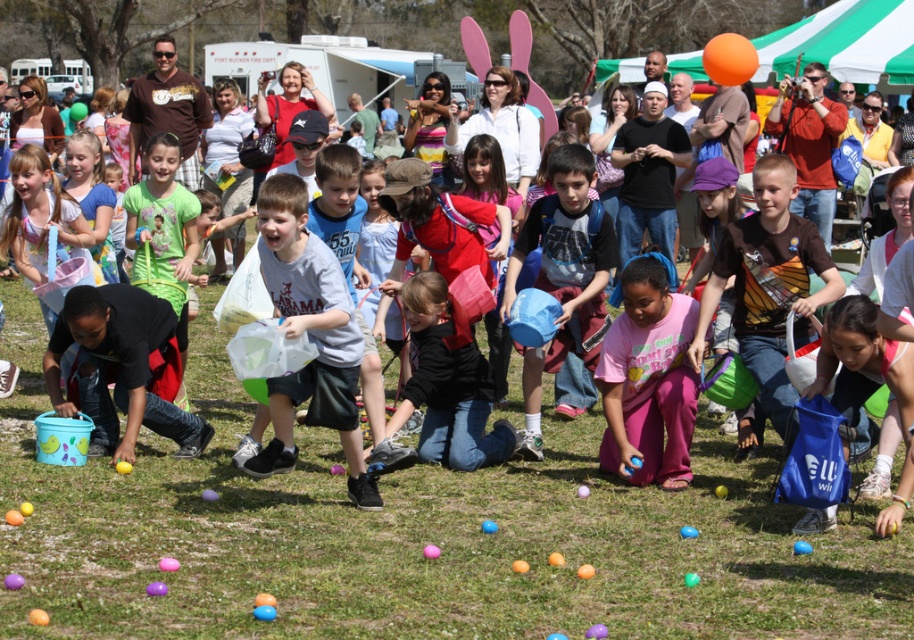
Does light gray t-shirt at center appear on the right side of black matte jacket at center?

Incorrect, light gray t-shirt at center is not on the right side of black matte jacket at center.

Which of these two, light gray t-shirt at center or black matte jacket at center, stands taller?

Standing taller between the two is light gray t-shirt at center.

Does point (289, 451) come closer to viewer compared to point (437, 454)?

Yes, point (289, 451) is closer to viewer.

Where is `light gray t-shirt at center`? light gray t-shirt at center is located at coordinates (309, 337).

Does point (645, 298) come closer to viewer compared to point (586, 150)?

Yes, point (645, 298) is in front of point (586, 150).

Does pink matte pants at center have a lesser height compared to blue fabric bucket at center?

Yes.

Does point (672, 346) come closer to viewer compared to point (598, 237)?

Yes, point (672, 346) is in front of point (598, 237).

Identify the location of pink matte pants at center. (647, 380).

The image size is (914, 640). Identify the location of light gray t-shirt at center. (309, 337).

What do you see at coordinates (309, 337) in the screenshot? This screenshot has height=640, width=914. I see `light gray t-shirt at center` at bounding box center [309, 337].

Does point (275, 403) come in front of point (636, 268)?

Yes, it is.

I want to click on light gray t-shirt at center, so click(x=309, y=337).